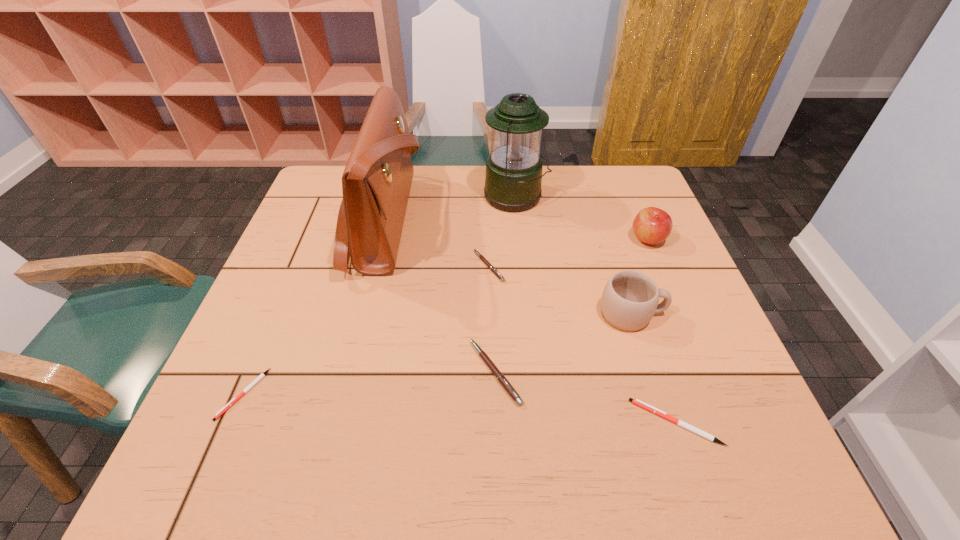
You are a GUI agent. You are given a task and a screenshot of the screen. Output one action in this format:
    pyautogui.click(x=<x>, y=<y>)
    Task: Click on the bigger white pen
    The width and height of the screenshot is (960, 540).
    Given the screenshot: What is the action you would take?
    pyautogui.click(x=637, y=402)

The width and height of the screenshot is (960, 540). Identify the location of the left white pen. (227, 406).

Image resolution: width=960 pixels, height=540 pixels. What are the coordinates of `the shortest pen` in the screenshot? It's located at (227, 406).

The height and width of the screenshot is (540, 960). Find the location of `free point located 0.350m on the front flap of the satchel`. free point located 0.350m on the front flap of the satchel is located at coordinates (543, 221).

Identify the location of free point located on the right of the green lantern. (623, 197).

This screenshot has width=960, height=540. In order to click on vacant space located on the left of the apple in this screenshot , I will do `click(503, 239)`.

Identify the location of vacant region located at the nib of the bigger pink pen. click(x=440, y=372).

Image resolution: width=960 pixels, height=540 pixels. Identify the location of vacant area located at the nib of the bigger pink pen. (347, 372).

Identify the location of free region located 0.180m at the nib of the bigger pink pen. (381, 372).

Where is `vacant space situated at the nib of the smaller pink pen`? vacant space situated at the nib of the smaller pink pen is located at coordinates (382, 266).